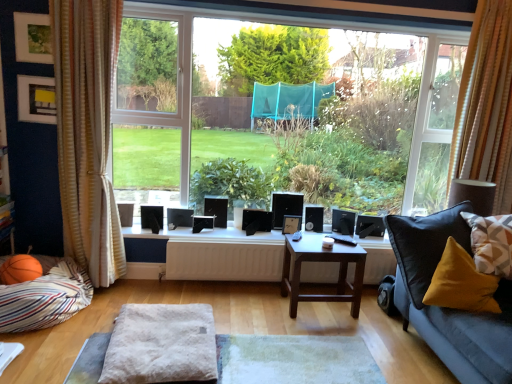
Question: Is matte black picture frame at upper left, which is counted as the 2th picture frame, starting from the bottom, wider than fuzzy fabric ottoman at center?

Choices:
 (A) no
 (B) yes

Answer: (A)

Question: From a real-world perspective, is matte black picture frame at upper left, which is the first picture frame from left to right, positioned under fuzzy fabric ottoman at center based on gravity?

Choices:
 (A) no
 (B) yes

Answer: (A)

Question: Is fuzzy fabric ottoman at center inside matte black picture frame at upper left, which is counted as the 2th picture frame, starting from the bottom?

Choices:
 (A) no
 (B) yes

Answer: (A)

Question: Could you tell me if matte black picture frame at upper left, which is the first picture frame from left to right, is facing fuzzy fabric ottoman at center?

Choices:
 (A) no
 (B) yes

Answer: (A)

Question: From a real-world perspective, does matte black picture frame at upper left, which is counted as the 2th picture frame, starting from the bottom, stand above fuzzy fabric ottoman at center?

Choices:
 (A) yes
 (B) no

Answer: (A)

Question: From the image's perspective, is wooden picture frame at center, placed as the third picture frame when sorted from left to right, above or below transparent glass window at center?

Choices:
 (A) above
 (B) below

Answer: (B)

Question: Is wooden picture frame at center, the first picture frame in the back-to-front sequence, taller or shorter than transparent glass window at center?

Choices:
 (A) tall
 (B) short

Answer: (B)

Question: Looking at their shapes, would you say wooden picture frame at center, the first picture frame in the back-to-front sequence, is wider or thinner than transparent glass window at center?

Choices:
 (A) wide
 (B) thin

Answer: (B)

Question: Does point (286, 218) appear closer or farther from the camera than point (224, 122)?

Choices:
 (A) farther
 (B) closer

Answer: (B)

Question: Is velvet yellow pillow at lower right, which appears as the second pillow when viewed from the right, to the left or to the right of wooden picture frame at center, placed as the third picture frame when sorted from left to right, in the image?

Choices:
 (A) left
 (B) right

Answer: (B)

Question: From the image's perspective, is velvet yellow pillow at lower right, acting as the 2th pillow starting from the left, above or below wooden picture frame at center, arranged as the 1th picture frame when ordered from the bottom?

Choices:
 (A) above
 (B) below

Answer: (B)

Question: Considering the positions of velvet yellow pillow at lower right, which appears as the second pillow when viewed from the right, and wooden picture frame at center, the 3th picture frame when ordered from top to bottom, in the image, is velvet yellow pillow at lower right, which appears as the second pillow when viewed from the right, taller or shorter than wooden picture frame at center, the 3th picture frame when ordered from top to bottom,?

Choices:
 (A) tall
 (B) short

Answer: (A)

Question: Is velvet yellow pillow at lower right, which appears as the second pillow when viewed from the right, bigger or smaller than wooden picture frame at center, placed as the third picture frame when sorted from left to right?

Choices:
 (A) small
 (B) big

Answer: (B)

Question: Is dark brown wooden table at center situated inside fuzzy fabric ottoman at center or outside?

Choices:
 (A) inside
 (B) outside

Answer: (B)

Question: Is dark brown wooden table at center wider or thinner than fuzzy fabric ottoman at center?

Choices:
 (A) thin
 (B) wide

Answer: (A)